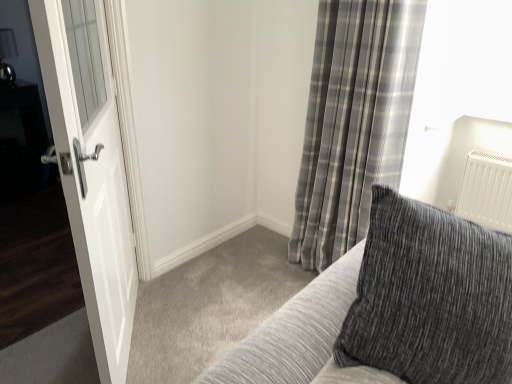
Question: Considering their positions, is gray plaid curtain at upper right located in front of or behind white glossy door at left?

Choices:
 (A) front
 (B) behind

Answer: (B)

Question: Does point [x=316, y=104] appear closer or farther from the camera than point [x=67, y=69]?

Choices:
 (A) closer
 (B) farther

Answer: (B)

Question: Estimate the real-world distances between objects in this image. Which object is farther from the white glossy door at left?

Choices:
 (A) textured gray pillow at upper right
 (B) gray plaid curtain at upper right

Answer: (B)

Question: Estimate the real-world distances between objects in this image. Which object is closer to the white glossy door at left?

Choices:
 (A) gray plaid curtain at upper right
 (B) textured gray pillow at upper right

Answer: (B)